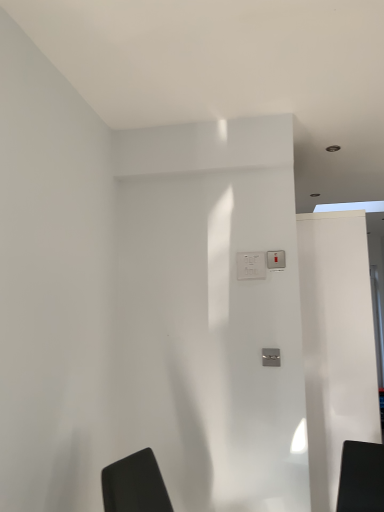
What do you see at coordinates (336, 344) in the screenshot? The height and width of the screenshot is (512, 384). I see `white glossy screen door at right` at bounding box center [336, 344].

Describe the element at coordinates (251, 265) in the screenshot. I see `white plastic electric outlet at center` at that location.

In order to face metallic silver light switch at center, should I rotate leftwards or rightwards?

To face it directly, rotate right by 11.343 degrees.

Identify the location of white glossy screen door at right. The height and width of the screenshot is (512, 384). (336, 344).

From the image's perspective, is metallic silver light switch at center located above white glossy screen door at right?

Yes, from the image's perspective, metallic silver light switch at center is on top of white glossy screen door at right.

From a real-world perspective, is metallic silver light switch at center physically located above or below white glossy screen door at right?

metallic silver light switch at center is situated higher than white glossy screen door at right in the real world.

Does metallic silver light switch at center have a lesser height compared to white glossy screen door at right?

Yes.

Could you tell me if metallic silver light switch at center is turned towards white glossy screen door at right?

No.

Between white glossy screen door at right and white plastic electric outlet at center, which one has smaller width?

Thinner between the two is white plastic electric outlet at center.

In the image, is white glossy screen door at right on the left side or the right side of white plastic electric outlet at center?

In the image, white glossy screen door at right appears on the right side of white plastic electric outlet at center.

Is white glossy screen door at right located outside white plastic electric outlet at center?

Yes, white glossy screen door at right is outside of white plastic electric outlet at center.

This screenshot has width=384, height=512. Find the location of `electric outlet that appears above the white glossy screen door at right (from a real-world perspective)`. electric outlet that appears above the white glossy screen door at right (from a real-world perspective) is located at coordinates (251, 265).

Who is taller, white plastic electric outlet at center or metallic silver light switch at center?

Standing taller between the two is white plastic electric outlet at center.

Could you tell me if white plastic electric outlet at center is turned towards metallic silver light switch at center?

No, white plastic electric outlet at center is not oriented towards metallic silver light switch at center.

Does white plastic electric outlet at center have a smaller size compared to metallic silver light switch at center?

Incorrect, white plastic electric outlet at center is not smaller in size than metallic silver light switch at center.

Is white plastic electric outlet at center positioned behind metallic silver light switch at center?

Yes, it is behind metallic silver light switch at center.

Considering the sizes of objects white plastic electric outlet at center and white glossy screen door at right in the image provided, who is wider, white plastic electric outlet at center or white glossy screen door at right?

With larger width is white glossy screen door at right.

Locate an element on the screen. The width and height of the screenshot is (384, 512). screen door behind the white plastic electric outlet at center is located at coordinates (336, 344).

Is white plastic electric outlet at center aimed at white glossy screen door at right?

No, white plastic electric outlet at center is not facing towards white glossy screen door at right.

How far apart are white plastic electric outlet at center and white glossy screen door at right?

They are 25.94 inches apart.

Could you tell me if metallic silver light switch at center is facing white plastic electric outlet at center?

No, metallic silver light switch at center is not aimed at white plastic electric outlet at center.

How much distance is there between metallic silver light switch at center and white plastic electric outlet at center?

metallic silver light switch at center is 3.18 inches away from white plastic electric outlet at center.

Based on the photo, is metallic silver light switch at center taller than white plastic electric outlet at center?

In fact, metallic silver light switch at center may be shorter than white plastic electric outlet at center.

Considering the relative positions of metallic silver light switch at center and white plastic electric outlet at center in the image provided, is metallic silver light switch at center to the left of white plastic electric outlet at center from the viewer's perspective?

No.

Considering the points (312, 334) and (267, 267), which point is in front, point (312, 334) or point (267, 267)?

The point (267, 267) is more forward.

Measure the distance between white glossy screen door at right and metallic silver light switch at center.

white glossy screen door at right is 65.34 centimeters from metallic silver light switch at center.

Is metallic silver light switch at center inside white glossy screen door at right?

That's incorrect, metallic silver light switch at center is not inside white glossy screen door at right.

Which object is closer to the camera taking this photo, white glossy screen door at right or metallic silver light switch at center?

Positioned in front is metallic silver light switch at center.

Find the location of a particular element. The width and height of the screenshot is (384, 512). screen door that appears behind the metallic silver light switch at center is located at coordinates [x=336, y=344].

Identify the location of electric outlet positioned vertically above the white glossy screen door at right (from a real-world perspective). (251, 265).

Based on their spatial positions, is white glossy screen door at right or metallic silver light switch at center further from white plastic electric outlet at center?

white glossy screen door at right is further to white plastic electric outlet at center.

Which object lies nearer to the anchor point white glossy screen door at right, white plastic electric outlet at center or metallic silver light switch at center?

metallic silver light switch at center is positioned closer to the anchor white glossy screen door at right.

Based on their spatial positions, is white plastic electric outlet at center or white glossy screen door at right closer to metallic silver light switch at center?

The object closer to metallic silver light switch at center is white plastic electric outlet at center.

Based on their spatial positions, is metallic silver light switch at center or white plastic electric outlet at center further from white glossy screen door at right?

white plastic electric outlet at center is further to white glossy screen door at right.

Considering their positions, is white glossy screen door at right positioned further to metallic silver light switch at center than white plastic electric outlet at center?

Based on the image, white glossy screen door at right appears to be further to metallic silver light switch at center.

Estimate the real-world distances between objects in this image. Which object is closer to white plastic electric outlet at center, metallic silver light switch at center or white glossy screen door at right?

Based on the image, metallic silver light switch at center appears to be nearer to white plastic electric outlet at center.

Where is `electric outlet between metallic silver light switch at center and white glossy screen door at right in the up-down direction`? The height and width of the screenshot is (512, 384). electric outlet between metallic silver light switch at center and white glossy screen door at right in the up-down direction is located at coordinates (251, 265).